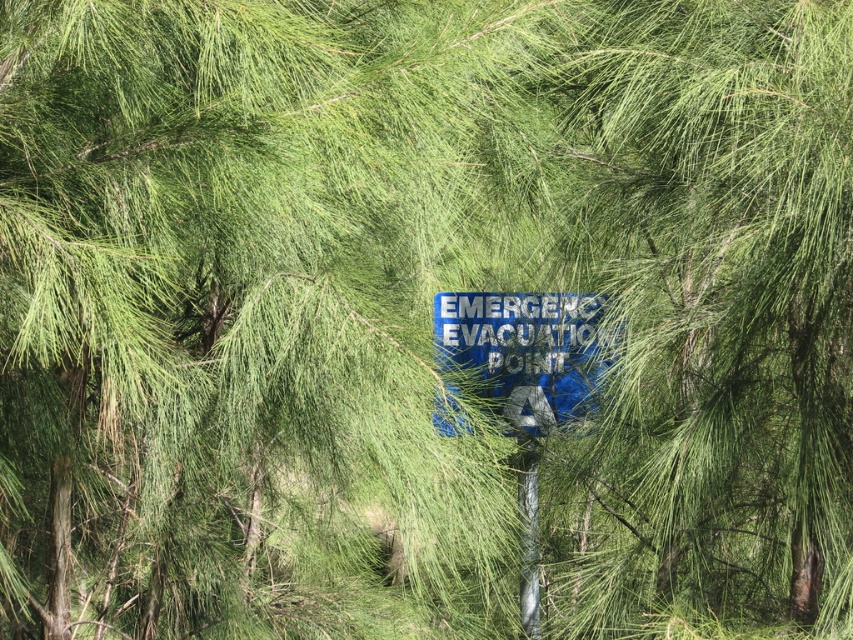
You are a hiker who needs to read the emergency evacuation sign. The blue plastic sign at center is partially hidden by pine branches. Can you see the entire metallic silver pole at center from your current position?

The blue plastic sign at center is bigger than metallic silver pole at center, so the pole is smaller and might be fully visible even if partially obscured by the branches. However, since the sign itself is partially hidden, it is possible that the pole could also be partially hidden depending on the branches. The answer requires more information about the branches obscuring the sign.

You are a drone operator trying to capture a clear photo of the sign. You notice two points marked on your screen at coordinates point (508, 390) and point (531, 556). Which point is closer to the camera lens?

Point (531, 556) is closer to the camera lens because the Objects Description states that point (508, 390) is further away than point (531, 556).

You are a maintenance worker needing to replace the blue plastic sign at center. The replacement sign requires a pole that is at least 12 inches away to avoid obstruction. Based on the scene, will the existing metallic silver pole at center allow the new sign to be installed properly?

The distance between the blue plastic sign at center and the metallic silver pole at center is 12.04 inches, which meets the requirement of at least 12 inches. Therefore, the existing metallic silver pole at center allows the new sign to be installed properly without obstruction.